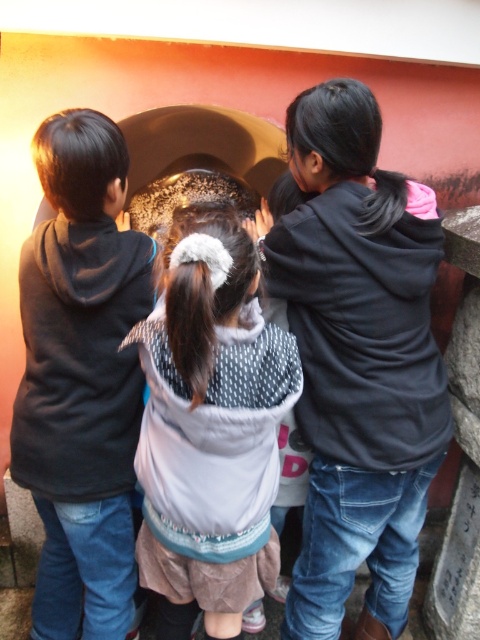
Can you confirm if black matte hoodie at upper right is positioned above matte black hoodie at left?

Yes.

Does black matte hoodie at upper right have a lesser height compared to matte black hoodie at left?

No.

The height and width of the screenshot is (640, 480). I want to click on black matte hoodie at upper right, so click(x=358, y=358).

This screenshot has width=480, height=640. I want to click on black matte hoodie at upper right, so click(x=358, y=358).

Who is more distant from viewer, (x=88, y=282) or (x=267, y=573)?

Point (x=267, y=573)

This screenshot has height=640, width=480. What are the coordinates of `matte black hoodie at left` in the screenshot? It's located at (82, 378).

Who is positioned more to the left, black matte hoodie at upper right or white dotted sweater at center?

Positioned to the left is white dotted sweater at center.

What do you see at coordinates (358, 358) in the screenshot? I see `black matte hoodie at upper right` at bounding box center [358, 358].

Find the location of a particular element. The image size is (480, 640). black matte hoodie at upper right is located at coordinates (358, 358).